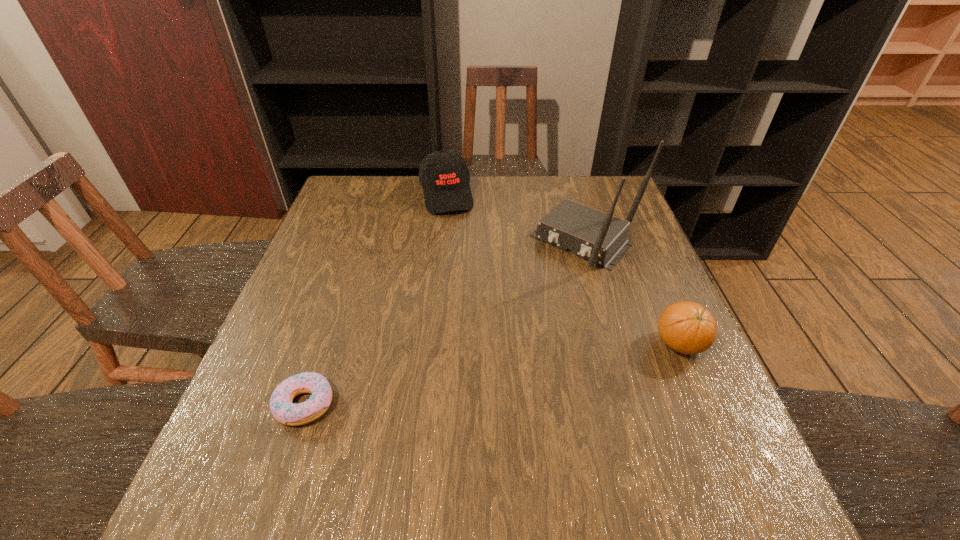
Find the location of a particular element. vacant spot on the desktop that is between the doughnut and the third tallest object and is positioned on the back of the router to connect cables is located at coordinates (452, 381).

You are a GUI agent. You are given a task and a screenshot of the screen. Output one action in this format:
    pyautogui.click(x=<x>, y=<y>)
    Task: Click on the free space on the desktop that is between the leftmost object and the third tallest object and is positioned on the front-facing side of the baseball cap
    
    Given the screenshot: What is the action you would take?
    pyautogui.click(x=500, y=373)